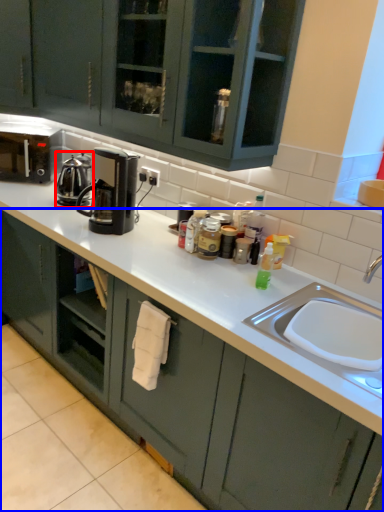
Question: Which of the following is the closest to the observer, kitchen appliance (highlighted by a red box) or cabinetry (highlighted by a blue box)?

Choices:
 (A) kitchen appliance
 (B) cabinetry

Answer: (B)